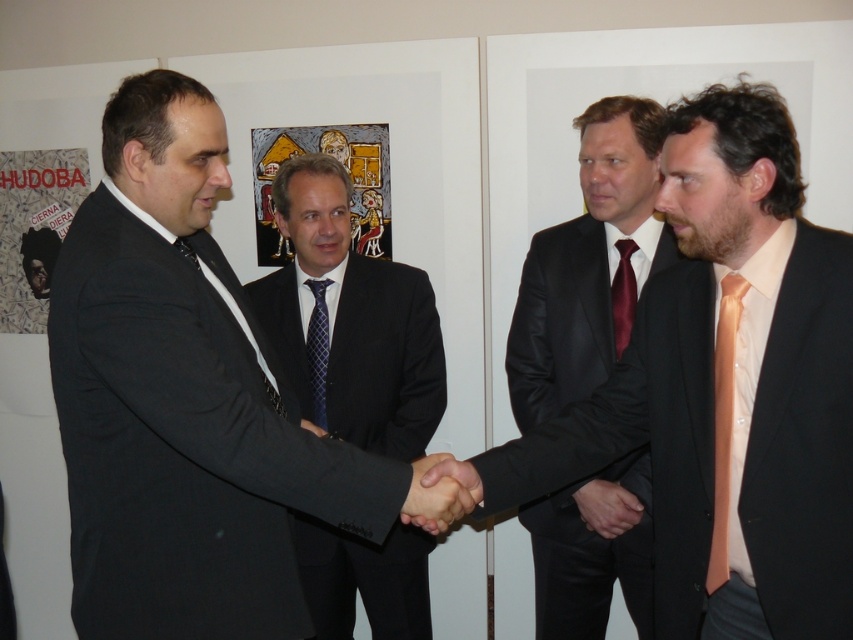
Does orange silk tie at right have a smaller size compared to black satin hand at center?

Incorrect, orange silk tie at right is not smaller in size than black satin hand at center.

Does orange silk tie at right have a larger size compared to black satin hand at center?

Indeed, orange silk tie at right has a larger size compared to black satin hand at center.

Is point (721, 412) in front of point (468, 484)?

That is True.

Find the location of a particular element. The height and width of the screenshot is (640, 853). orange silk tie at right is located at coordinates (723, 422).

Does dark blue textured suit at center have a greater width compared to smooth black hand at center?

Correct, the width of dark blue textured suit at center exceeds that of smooth black hand at center.

Which is in front, point (352, 332) or point (633, 497)?

Positioned in front is point (633, 497).

Is point (312, 300) more distant than point (601, 522)?

Yes, point (312, 300) is farther from viewer.

Image resolution: width=853 pixels, height=640 pixels. Identify the location of dark blue textured suit at center. (352, 317).

Does matte black suit at center appear under dark blue textured suit at center?

No, matte black suit at center is not below dark blue textured suit at center.

Does matte black suit at center appear on the left side of dark blue textured suit at center?

No, matte black suit at center is not to the left of dark blue textured suit at center.

Find the location of a particular element. Image resolution: width=853 pixels, height=640 pixels. matte black suit at center is located at coordinates (727, 390).